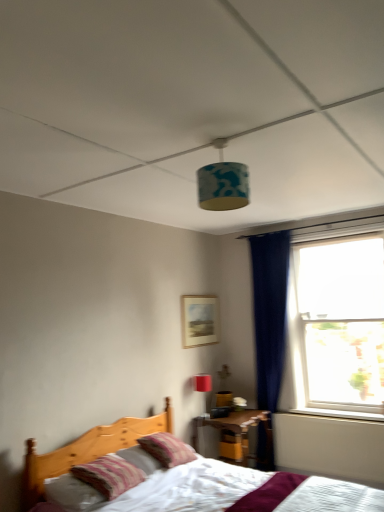
Where is `empty space that is ontop of white plastic window sill at lower right (from a real-world perspective)`? This screenshot has width=384, height=512. empty space that is ontop of white plastic window sill at lower right (from a real-world perspective) is located at coordinates (334, 411).